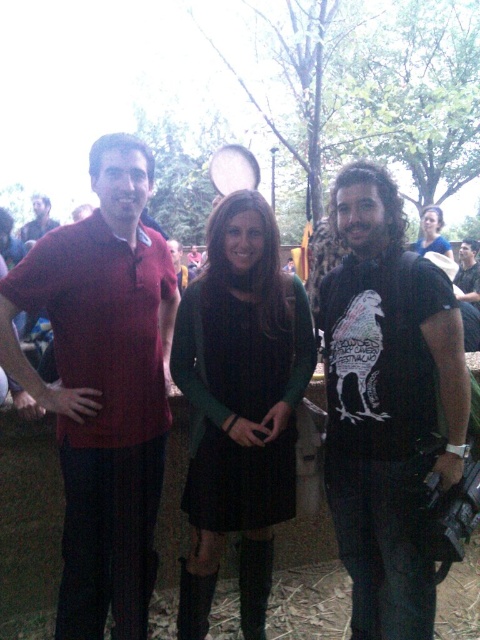
Question: Which point is farther to the camera?

Choices:
 (A) matte black shirt at center
 (B) matte red polo shirt at left

Answer: (A)

Question: From the image, what is the correct spatial relationship of matte black shirt at center in relation to matte red shirt at left?

Choices:
 (A) left
 (B) right

Answer: (B)

Question: Which point is closer to the camera?

Choices:
 (A) black cotton t-shirt at center
 (B) matte black shirt at center
 (C) matte red polo shirt at left
 (D) matte red shirt at left

Answer: (A)

Question: Which point is closer to the camera taking this photo?

Choices:
 (A) (422, 234)
 (B) (191, 339)

Answer: (B)

Question: Can you confirm if matte red polo shirt at left is bigger than matte green sweater at center?

Choices:
 (A) no
 (B) yes

Answer: (B)

Question: Is black cotton t-shirt at center above matte black shirt at center?

Choices:
 (A) yes
 (B) no

Answer: (B)